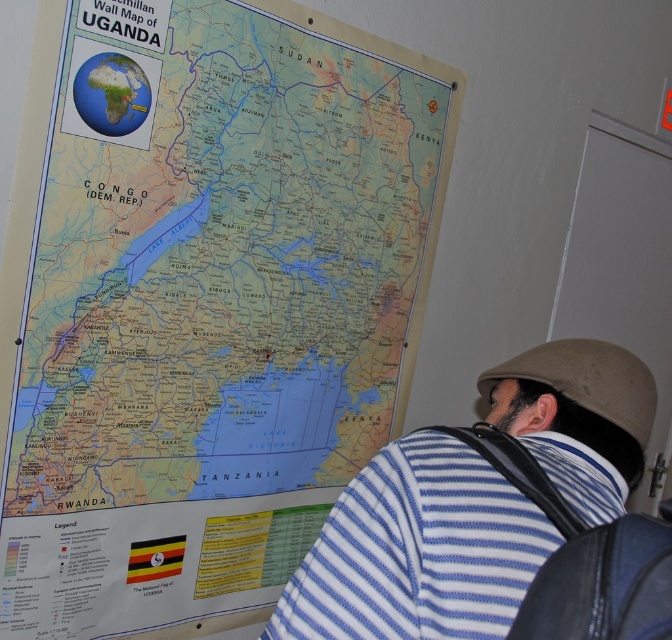
Question: Is matte paper map at upper center to the left of blue striped shirt at center from the viewer's perspective?

Choices:
 (A) no
 (B) yes

Answer: (B)

Question: Which object is farther from the camera taking this photo?

Choices:
 (A) matte paper map at upper center
 (B) blue striped shirt at center

Answer: (A)

Question: Does matte paper map at upper center come behind blue striped shirt at center?

Choices:
 (A) no
 (B) yes

Answer: (B)

Question: Among these points, which one is nearest to the camera?

Choices:
 (A) (142, 182)
 (B) (358, 486)

Answer: (B)

Question: In this image, where is matte paper map at upper center located relative to blue striped shirt at center?

Choices:
 (A) below
 (B) above

Answer: (B)